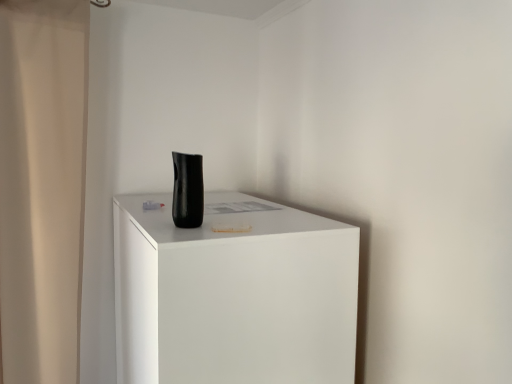
Locate an element on the screen. free point to the right of black matte vase at center is located at coordinates (259, 226).